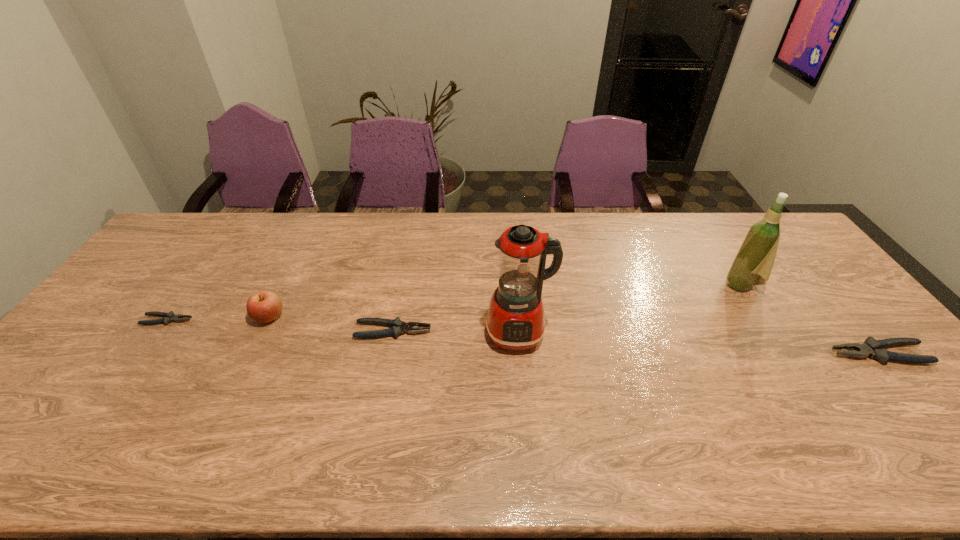
Identify the location of vacant space that is in between the fourth object from left to right and the rightmost object. (699, 344).

The image size is (960, 540). Find the location of `empty space that is in between the nearest pliers and the farthest object`. empty space that is in between the nearest pliers and the farthest object is located at coordinates (810, 320).

The image size is (960, 540). I want to click on vacant space that is in between the third object from right to left and the second shortest object, so click(456, 332).

Where is `empty location between the third object from right to left and the shortest pliers`? This screenshot has width=960, height=540. empty location between the third object from right to left and the shortest pliers is located at coordinates (343, 327).

Identify the location of free spot between the wine bottle and the rightmost pliers. This screenshot has width=960, height=540. (810, 320).

Where is `free space between the second pliers from right to left and the leftmost pliers`? free space between the second pliers from right to left and the leftmost pliers is located at coordinates (280, 326).

Select which object is the fourth closest to the farthest object. Please provide its 2D coordinates. Your answer should be formatted as a tuple, i.e. [(x, y)], where the tuple contains the x and y coordinates of a point satisfying the conditions above.

[(264, 306)]

Identify which object is the second nearest to the leftmost object. Please provide its 2D coordinates. Your answer should be formatted as a tuple, i.e. [(x, y)], where the tuple contains the x and y coordinates of a point satisfying the conditions above.

[(398, 327)]

Select which pliers appears as the second closest to the farthest object. Please provide its 2D coordinates. Your answer should be formatted as a tuple, i.e. [(x, y)], where the tuple contains the x and y coordinates of a point satisfying the conditions above.

[(398, 327)]

Identify which pliers is the nearest to the food processor. Please provide its 2D coordinates. Your answer should be formatted as a tuple, i.e. [(x, y)], where the tuple contains the x and y coordinates of a point satisfying the conditions above.

[(398, 327)]